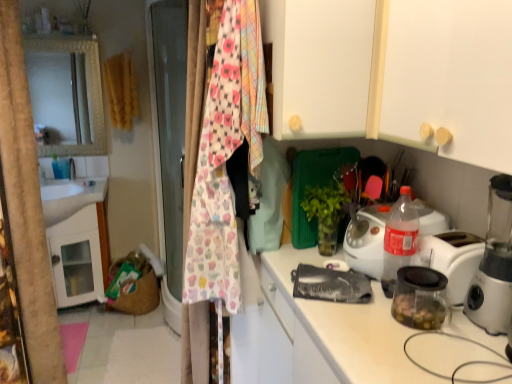
Question: From a real-world perspective, is transparent plastic blender at right positioned over white glossy sink at left based on gravity?

Choices:
 (A) yes
 (B) no

Answer: (A)

Question: From a real-world perspective, is transparent plastic blender at right below white glossy sink at left?

Choices:
 (A) yes
 (B) no

Answer: (B)

Question: Could white glossy sink at left be considered to be inside transparent plastic blender at right?

Choices:
 (A) no
 (B) yes

Answer: (A)

Question: From the image's perspective, would you say transparent plastic blender at right is shown under white glossy sink at left?

Choices:
 (A) no
 (B) yes

Answer: (B)

Question: Is transparent plastic blender at right completely or partially outside of white glossy sink at left?

Choices:
 (A) no
 (B) yes

Answer: (B)

Question: Is yellow fabric clothesline at upper left, which is counted as the 2th clothesline, starting from the bottom, inside or outside of cupcake-patterned fabric at center, the 1th clothesline positioned from the right?

Choices:
 (A) inside
 (B) outside

Answer: (B)

Question: Is yellow fabric clothesline at upper left, the 1th clothesline in the left-to-right sequence, to the left or to the right of cupcake-patterned fabric at center, which ranks as the 2th clothesline in top-to-bottom order, in the image?

Choices:
 (A) left
 (B) right

Answer: (A)

Question: Looking at the image, does yellow fabric clothesline at upper left, positioned as the first clothesline in back-to-front order, seem bigger or smaller compared to cupcake-patterned fabric at center, placed as the 2th clothesline when sorted from left to right?

Choices:
 (A) small
 (B) big

Answer: (A)

Question: Is point (129, 72) positioned closer to the camera than point (263, 72)?

Choices:
 (A) closer
 (B) farther

Answer: (B)

Question: In the image, is transparent glass jar at right positioned in front of or behind white matte cabinet at upper center?

Choices:
 (A) behind
 (B) front

Answer: (B)

Question: Looking at their shapes, would you say transparent glass jar at right is wider or thinner than white matte cabinet at upper center?

Choices:
 (A) thin
 (B) wide

Answer: (A)

Question: From a real-world perspective, is transparent glass jar at right above or below white matte cabinet at upper center?

Choices:
 (A) below
 (B) above

Answer: (A)

Question: Is point (291, 254) closer or farther from the camera than point (326, 137)?

Choices:
 (A) farther
 (B) closer

Answer: (A)

Question: In terms of size, does white matte cabinet at upper center appear bigger or smaller than transparent glass jar at right?

Choices:
 (A) big
 (B) small

Answer: (A)

Question: From a real-world perspective, relative to transparent glass jar at right, is white matte cabinet at upper center vertically above or below?

Choices:
 (A) below
 (B) above

Answer: (B)